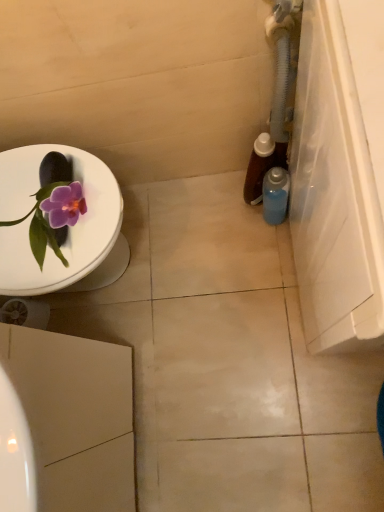
In order to face white glossy porcelain at lower left, should I rotate leftwards or rightwards?

You should look left and rotate roughly 21.658 degrees.

Describe the element at coordinates (75, 417) in the screenshot. I see `white glossy porcelain at lower left` at that location.

Image resolution: width=384 pixels, height=512 pixels. Find the location of `white glossy porcelain at lower left`. white glossy porcelain at lower left is located at coordinates (75, 417).

This screenshot has height=512, width=384. I want to click on white glossy porcelain at lower left, so click(x=75, y=417).